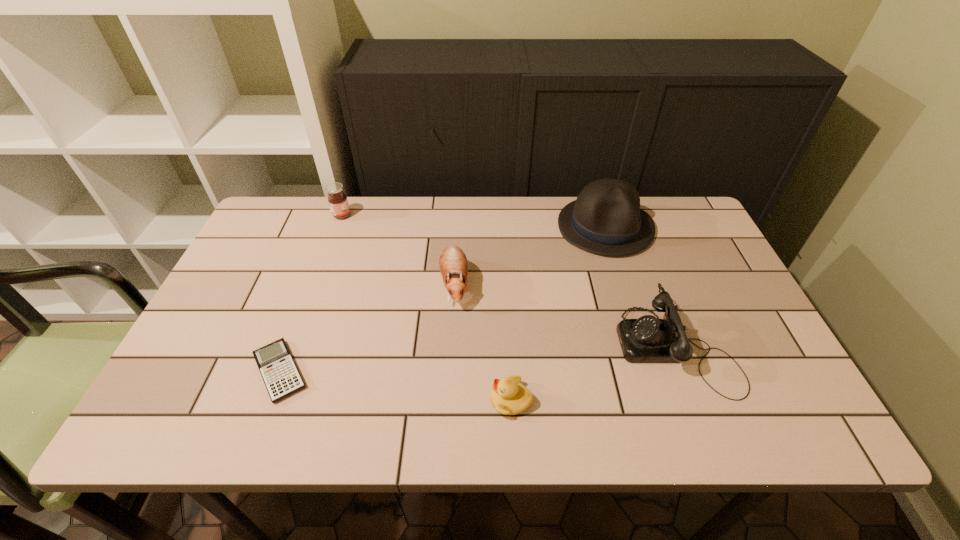
Where is `free point between the shortest object and the jam`? The image size is (960, 540). free point between the shortest object and the jam is located at coordinates (311, 293).

Image resolution: width=960 pixels, height=540 pixels. I want to click on free space between the jam and the fourth object from right to left, so click(398, 250).

Where is `free space between the telephone and the bowler hat`? This screenshot has height=540, width=960. free space between the telephone and the bowler hat is located at coordinates pyautogui.click(x=640, y=287).

At what (x,y) coordinates should I click in order to perform the action: click on vacant space that's between the duckling and the calculator. Please return your answer as a coordinate pair (x, y). Looking at the image, I should click on (396, 386).

Locate which object is the closest to the jam. Please provide its 2D coordinates. Your answer should be formatted as a tuple, i.e. [(x, y)], where the tuple contains the x and y coordinates of a point satisfying the conditions above.

[(453, 264)]

The height and width of the screenshot is (540, 960). I want to click on object that is the fourth closest to the hamster, so click(x=337, y=199).